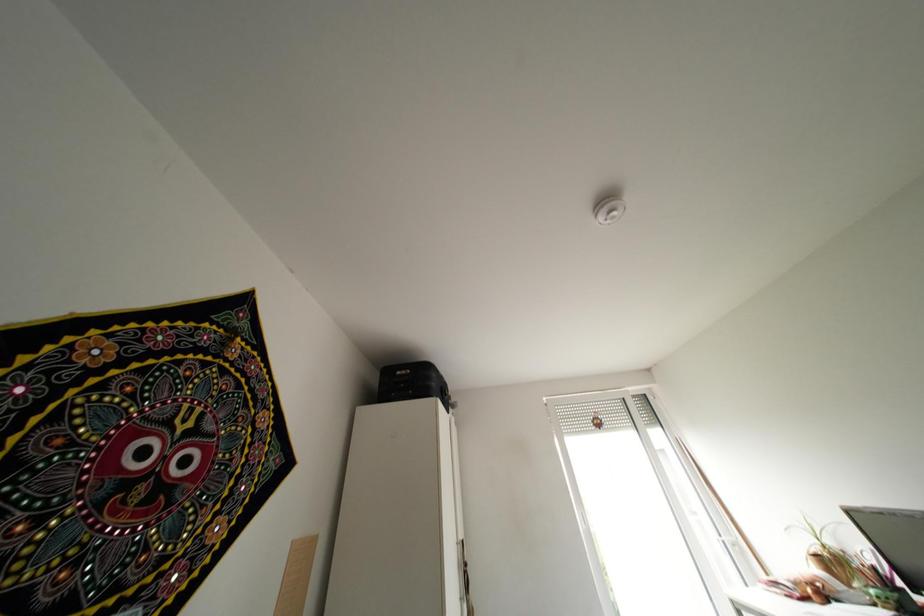
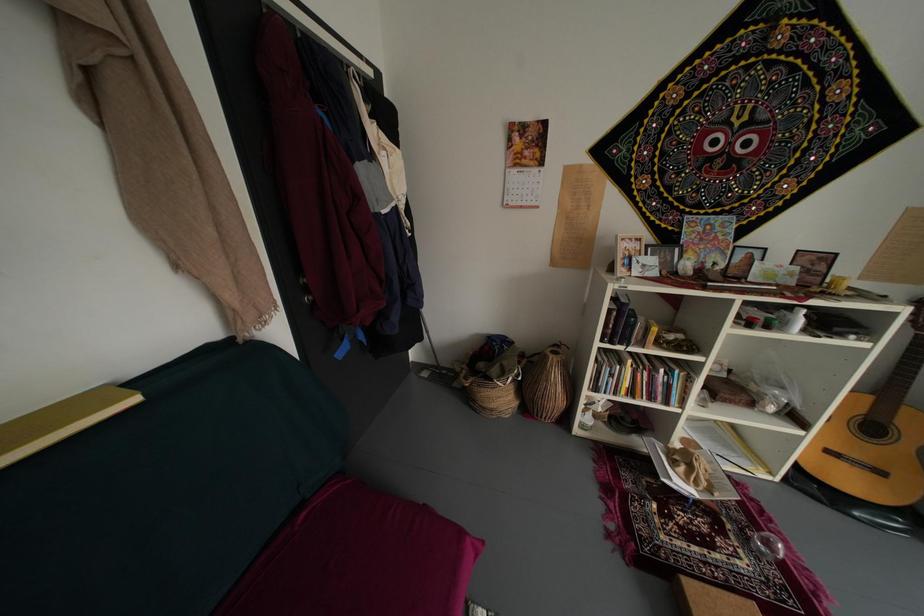
The first image is from the beginning of the video and the second image is from the end. How did the camera likely rotate when shooting the video?

The rotation direction of the camera is left-down.